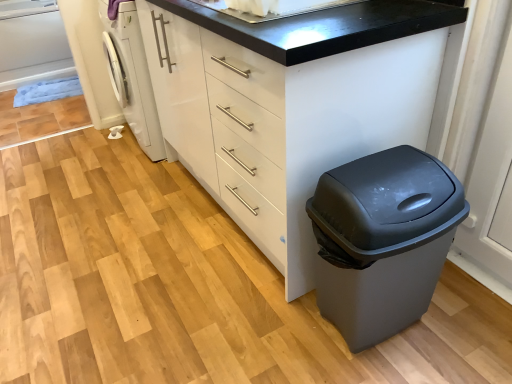
At what (x,y) coordinates should I click in order to perform the action: click on space that is in front of white matte chest of drawers at center. Please return your answer as a coordinate pair (x, y). This screenshot has width=512, height=384. Looking at the image, I should click on (236, 317).